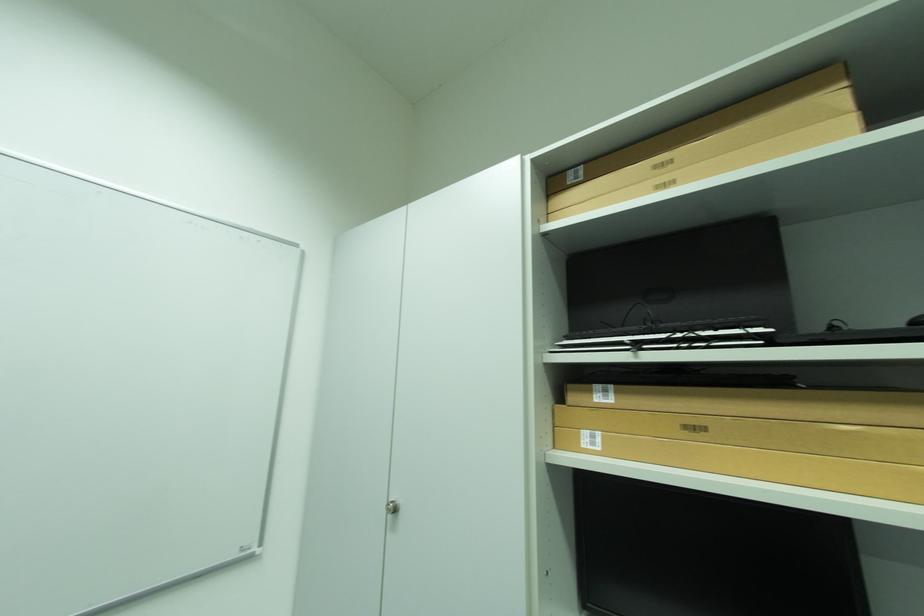
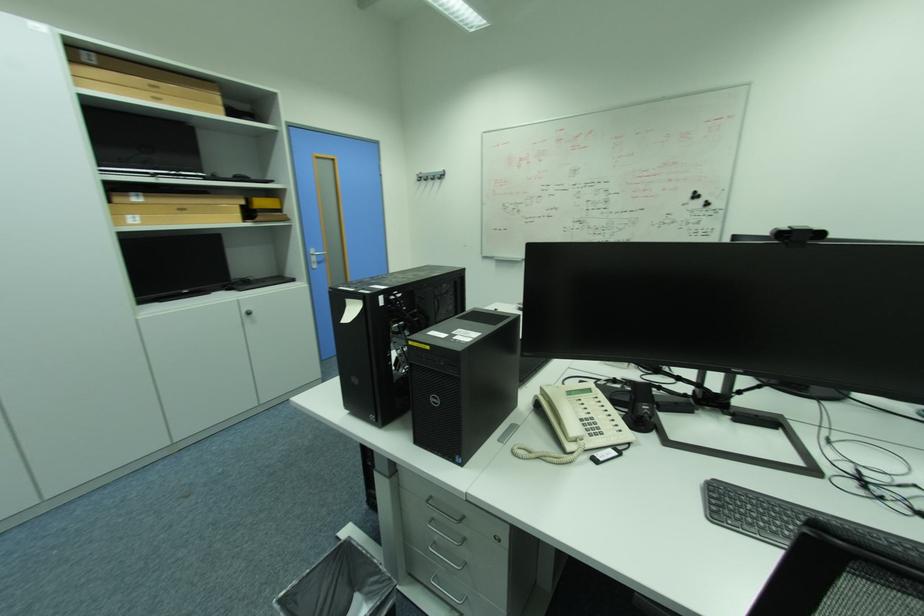
The point at (593, 434) is marked in the first image. Where is the corresponding point in the second image?

(136, 217)